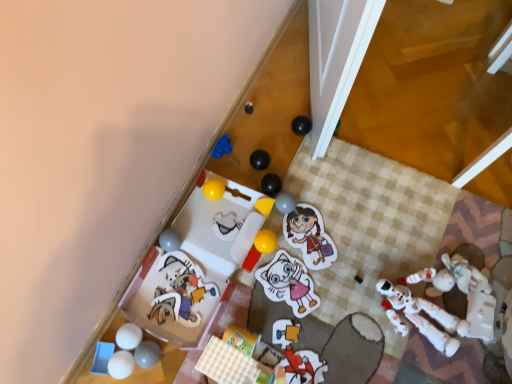
This screenshot has height=384, width=512. What are the coordinates of `vacant area that is in front of cartoon cat plush at lower left, positioned as the 5th toy in left-to-right order` in the screenshot? It's located at (x=167, y=351).